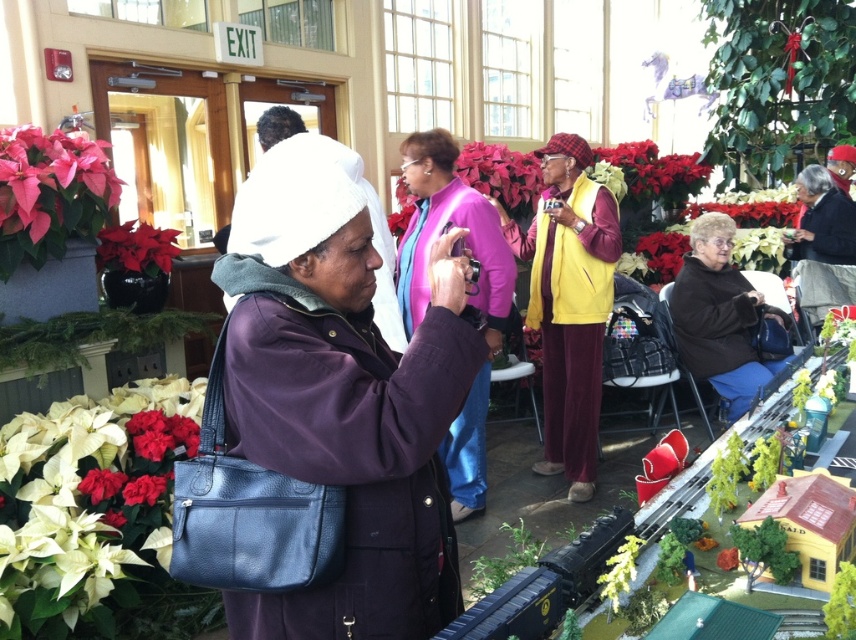
You are a photographer at the event and need to place a small decorative item between the yellow fabric vest at center and the matte red flower at left. Which object should you place it closer to if you want the item to be near the larger one?

You should place the item closer to the yellow fabric vest at center because it is larger than the matte red flower at left.

You are standing in the scene and notice two items, the yellow fabric vest at center and the matte red flower at left. Which one is located to the right of the other?

The yellow fabric vest at center is positioned on the right side of matte red flower at left.

You are a photographer standing at the camera position in the scene. You want to capture a photo of the white matte flower at lower left without any obstructions. The flower is 2.40 meters away from your current position. Can you reach it by moving forward 2 meters and then 0.4 meters to the left?

The white matte flower at lower left is 2.40 meters from the camera. Moving forward 2 meters and then 0.4 meters to the left would place you 2.4 meters away, so yes, you can reach it without obstruction.